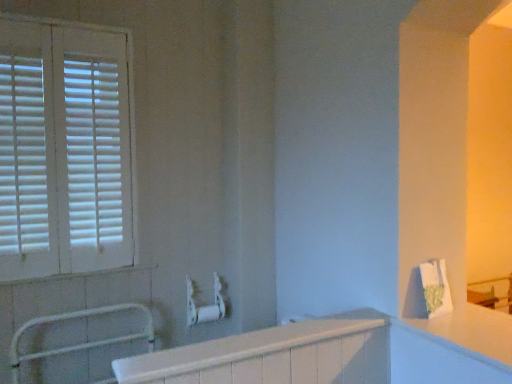
The image size is (512, 384). What are the coordinates of `vacant point above white wooden blinds at left (from a real-world perspective)` in the screenshot? It's located at (67, 13).